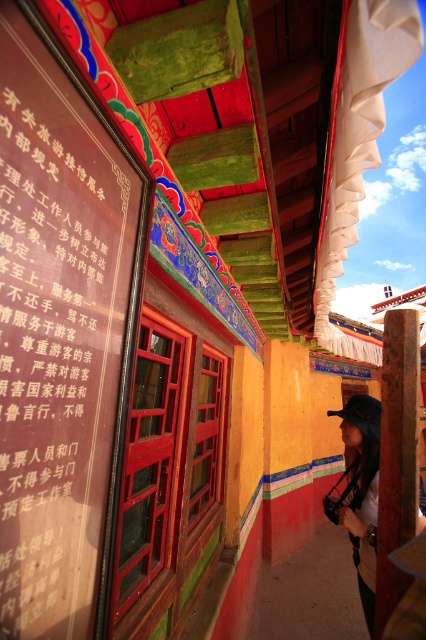
Question: Which point is closer to the camera taking this photo?

Choices:
 (A) (417, 316)
 (B) (54, 61)
 (C) (347, 515)

Answer: (B)

Question: Which of the following is the farthest from the observer?

Choices:
 (A) brown wooden post at center
 (B) matte black signboard at upper left
 (C) matte black hat at lower right

Answer: (C)

Question: Does brown wooden post at center have a lesser width compared to matte black hat at lower right?

Choices:
 (A) no
 (B) yes

Answer: (B)

Question: Does brown wooden post at center appear under matte black hat at lower right?

Choices:
 (A) no
 (B) yes

Answer: (A)

Question: Is matte black signboard at upper left further to the viewer compared to matte black hat at lower right?

Choices:
 (A) no
 (B) yes

Answer: (A)

Question: Which object is closer to the camera taking this photo?

Choices:
 (A) matte black hat at lower right
 (B) matte black signboard at upper left

Answer: (B)